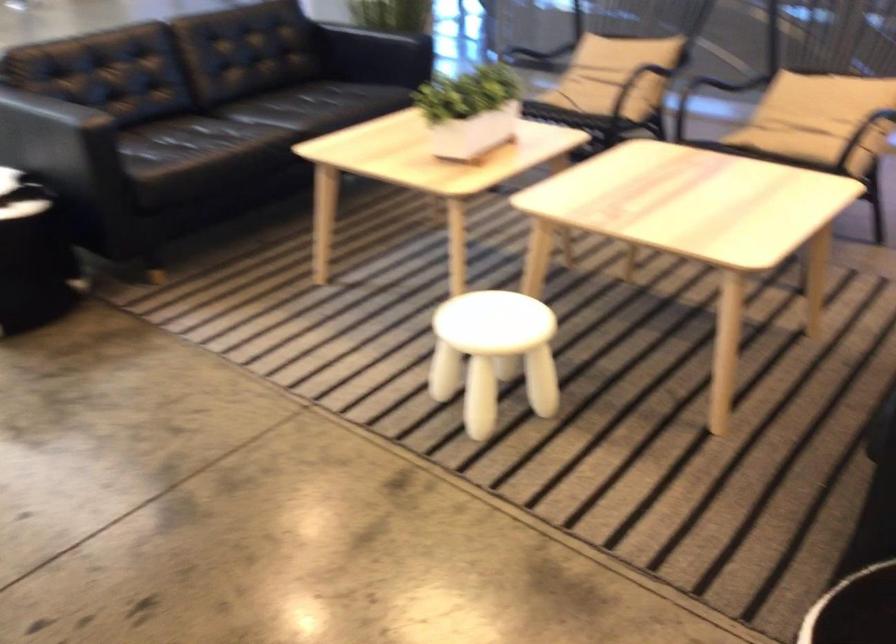
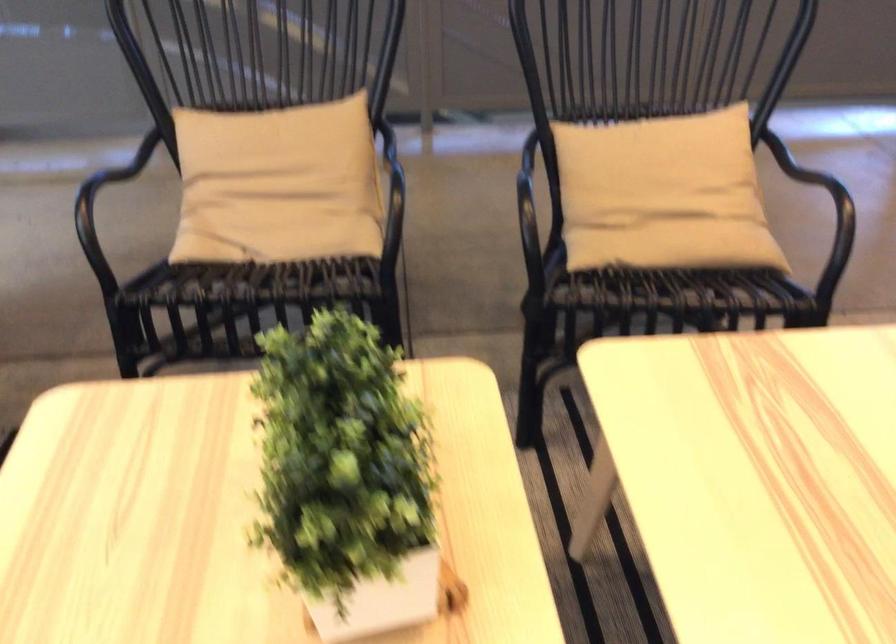
Where in the second image is the point corresponding to the point at 777,131 from the first image?

(674, 245)